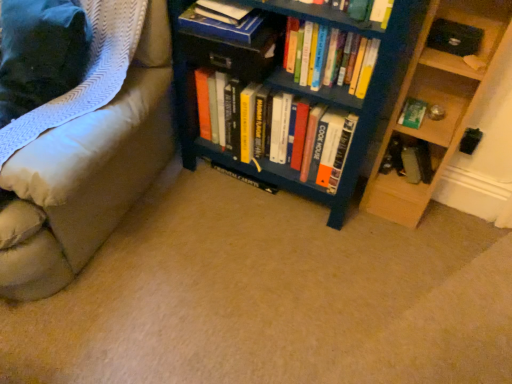
Question: From a real-world perspective, is white textured blanket at left positioned above or below wooden at right?

Choices:
 (A) below
 (B) above

Answer: (B)

Question: From the image's perspective, is white textured blanket at left positioned above or below wooden at right?

Choices:
 (A) below
 (B) above

Answer: (B)

Question: Which object is positioned farthest from the blue matte bookshelf at center?

Choices:
 (A) hardcover books at center, the 3th book positioned from the left
 (B) hardcover books at center, which is the third book in right-to-left order
 (C) green matte book at right, the fifth book positioned from the left
 (D) blue painted wood bookcase at center
 (E) hardcover book at upper center, the fifth book when ordered from right to left

Answer: (E)

Question: Which is nearer to the green matte book at right, which appears as the second book when viewed from the right?

Choices:
 (A) hardcover book at upper center, which appears as the 6th book when viewed from the right
 (B) white textured blanket at left
 (C) blue painted wood bookcase at center
 (D) wooden at right
 (E) hardcover books at center, the fourth book from the left

Answer: (D)